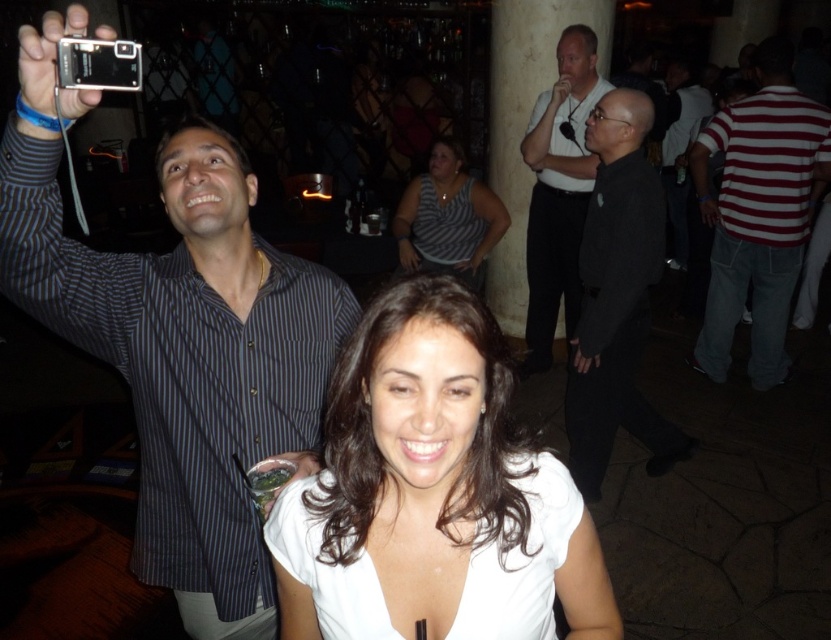
You are a photographer at the event and need to capture a group photo of the striped shirt at upper left and the red striped shirt at right. The camera you are using has a maximum focus range of 3 meters. Can you fit both subjects into the frame without moving either of them?

The striped shirt at upper left is 3.32 meters from the red striped shirt at right, which exceeds the camera maximum focus range of 3 meters. Therefore, you cannot fit both subjects into the frame without moving them.

You are a photographer at the event and need to capture a group photo of the black matte shirt at center and the striped fabric shirt at center. The camera you have can focus on objects within a 5 feet range. Will both subjects be in focus?

The black matte shirt at center is 4.79 feet from the striped fabric shirt at center. Since the distance between them is within the 5 feet range, both subjects will be in focus.